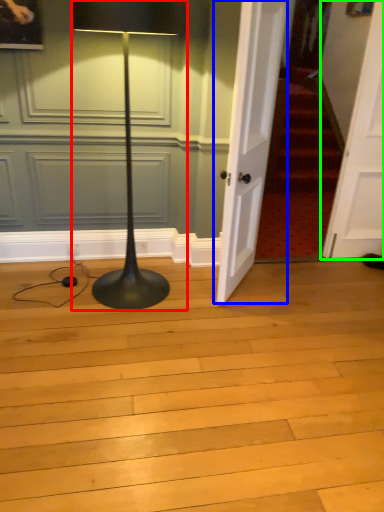
Question: Which object is the closest to the lamp (highlighted by a red box)? Choose among these: door (highlighted by a blue box) or door (highlighted by a green box).

Choices:
 (A) door
 (B) door

Answer: (A)